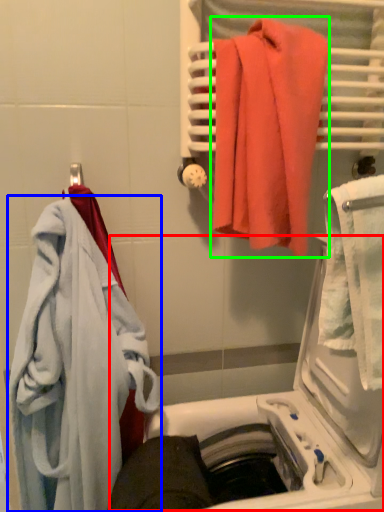
Question: Based on their relative distances, which object is farther from dish washer (highlighted by a red box)? Choose from towel (highlighted by a blue box) and towel (highlighted by a green box).

Choices:
 (A) towel
 (B) towel

Answer: (B)